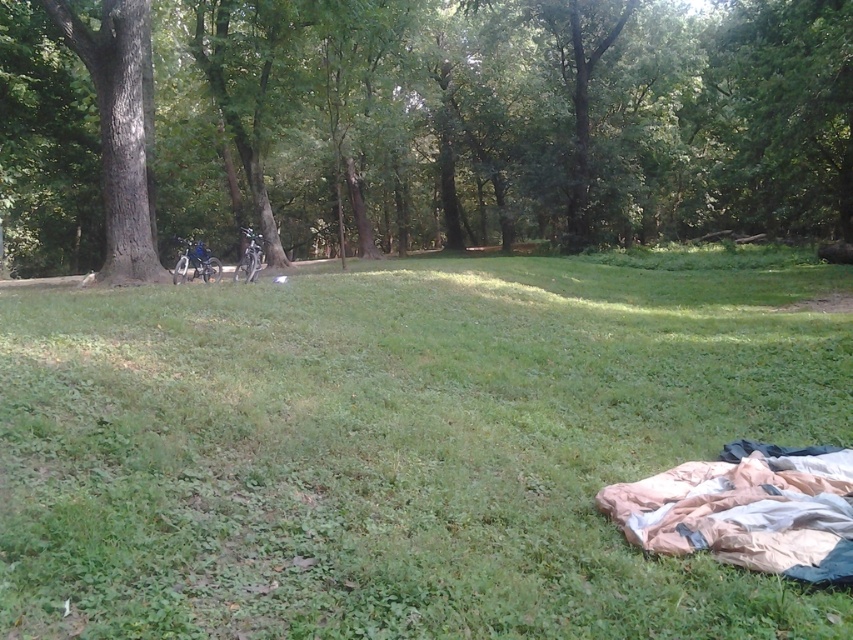
You are hiking in the park and want to take a break. You see a green leafy tree at center and a beige nylon sleeping bag at lower right. Which object is higher up in the image?

The green leafy tree at center is located above the beige nylon sleeping bag at lower right, so it is higher up in the image.